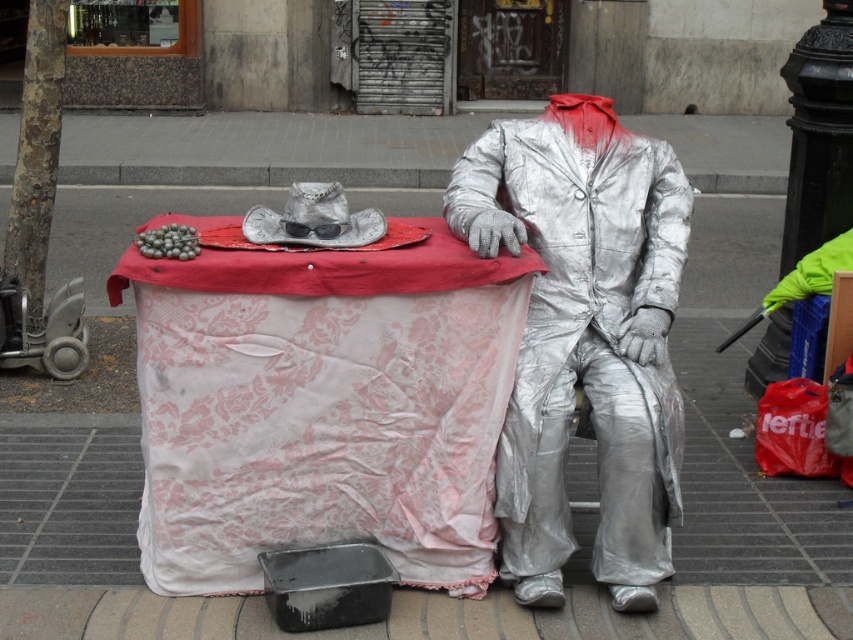
Question: Can you confirm if pink lace table at center is bigger than shiny metallic suit at center?

Choices:
 (A) no
 (B) yes

Answer: (B)

Question: Does pink lace table at center appear under shiny metallic suit at center?

Choices:
 (A) no
 (B) yes

Answer: (B)

Question: Which point appears farthest from the camera in this image?

Choices:
 (A) (355, 385)
 (B) (573, 355)

Answer: (B)

Question: Which point appears closest to the camera in this image?

Choices:
 (A) (515, 227)
 (B) (369, 532)

Answer: (A)

Question: Can you confirm if pink lace table at center is positioned to the right of shiny metallic suit at center?

Choices:
 (A) yes
 (B) no

Answer: (B)